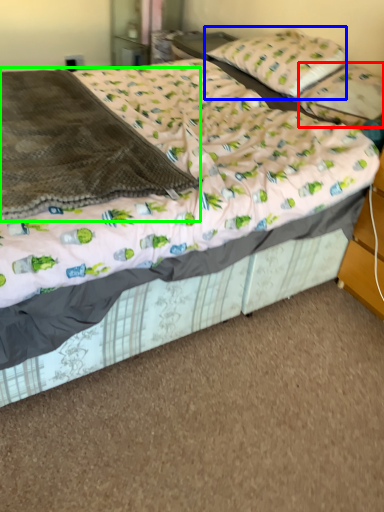
Question: Which object is positioned farthest from pillow (highlighted by a red box)? Select from pillow (highlighted by a blue box) and blanket (highlighted by a green box).

Choices:
 (A) pillow
 (B) blanket

Answer: (B)